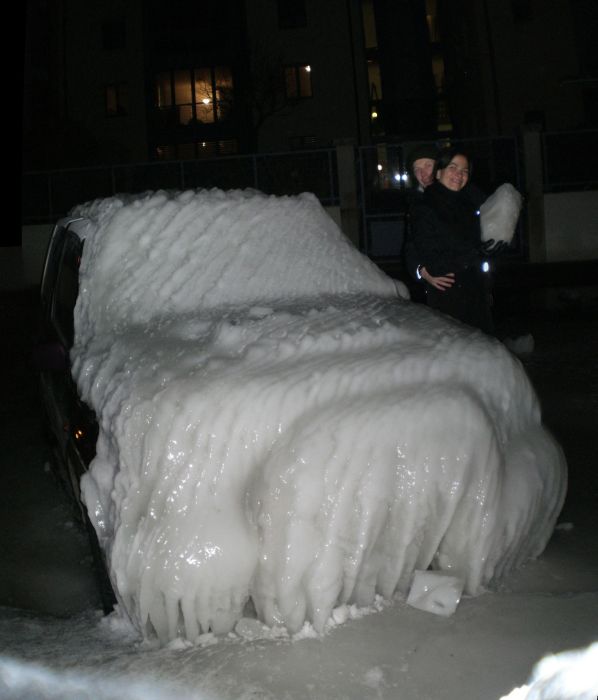
Find the location of a particular element. window is located at coordinates (196, 102).